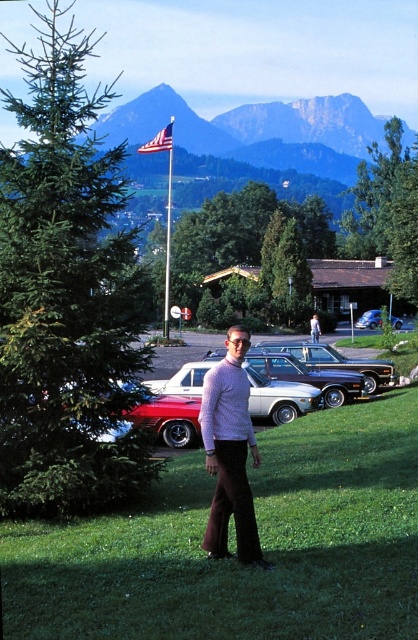
You are a photographer trying to capture the green leafy tree at left and the rocky mountain at upper center in the same frame. Which object will appear larger in the photo?

The green leafy tree at left will appear larger in the photo because it is closer to the viewer than the rocky mountain at upper center.

You are a photographer standing at the edge of the parking lot. You want to take a photo of the shiny black car at center. Where should you position yourself to capture the car in the best possible view?

The shiny black car at center is located at point (338, 362), so you should position yourself directly in front of that coordinate to capture the car in the best possible view.